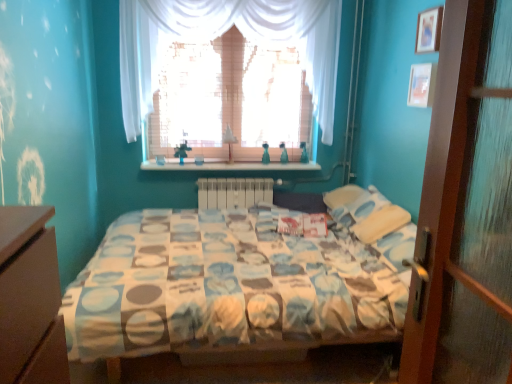
Find the location of a particular element. This screenshot has height=384, width=512. empty space that is ontop of white plastic radiator at center (from a real-world perspective) is located at coordinates (234, 171).